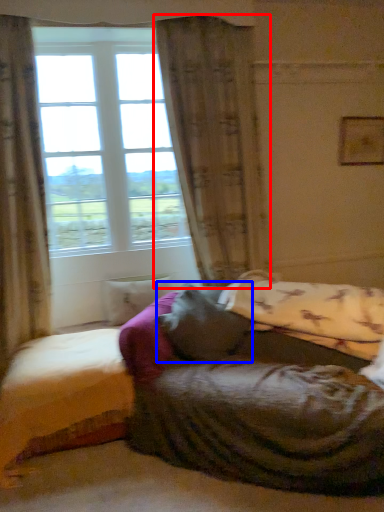
Question: Which object is further to the camera taking this photo, curtain (highlighted by a red box) or pillow (highlighted by a blue box)?

Choices:
 (A) curtain
 (B) pillow

Answer: (A)